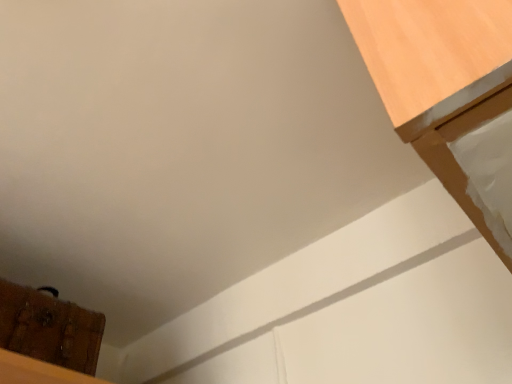
This screenshot has height=384, width=512. Find the location of `wooden chest at lower left`. wooden chest at lower left is located at coordinates (46, 338).

Describe the element at coordinates (46, 338) in the screenshot. This screenshot has width=512, height=384. I see `wooden chest at lower left` at that location.

Locate an element on the screen. This screenshot has width=512, height=384. wooden chest at lower left is located at coordinates (46, 338).